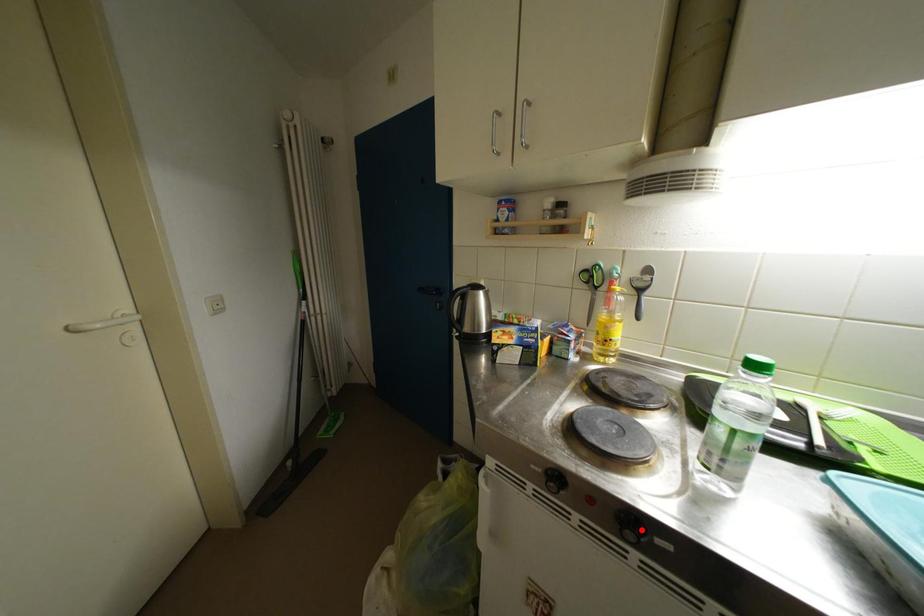
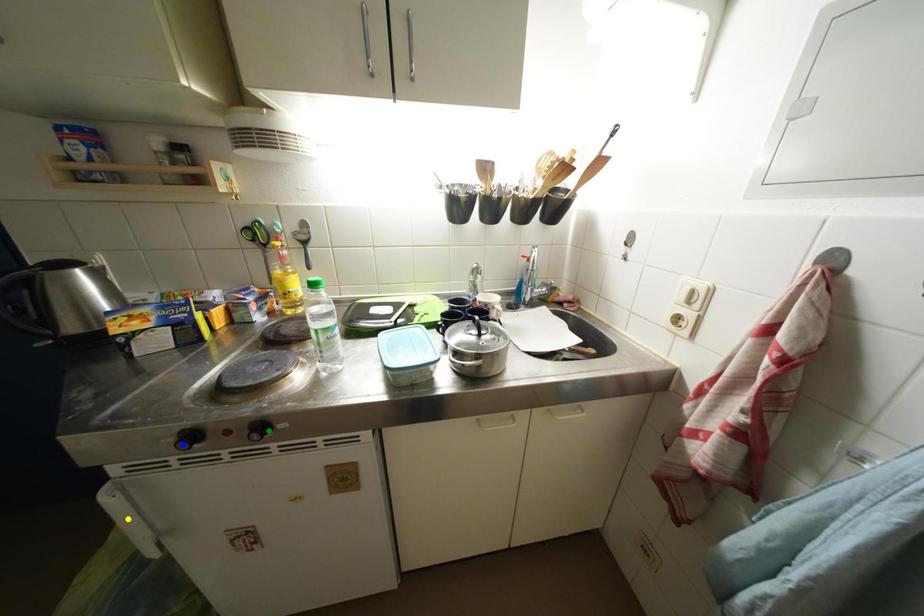
Question: I am providing you with two images of the same scene from different viewpoints. A red point is marked on the first image. You are given multiple points on the second image. Which point in image 2 is actually the same real-world point as the red point in image 1?

Choices:
 (A) green point
 (B) blue point
 (C) yellow point

Answer: (A)